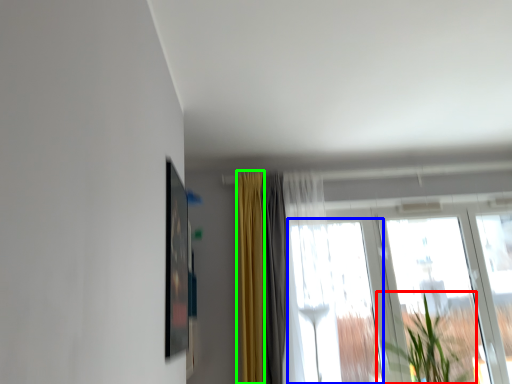
Question: Which is nearer to the houseplant (highlighted by a red box)? window (highlighted by a blue box) or curtain (highlighted by a green box).

Choices:
 (A) window
 (B) curtain

Answer: (A)